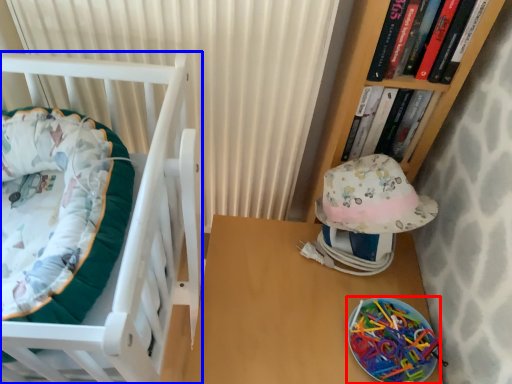
Question: Among these objects, which one is farthest to the camera, glass plate (highlighted by a red box) or furniture (highlighted by a blue box)?

Choices:
 (A) glass plate
 (B) furniture

Answer: (A)